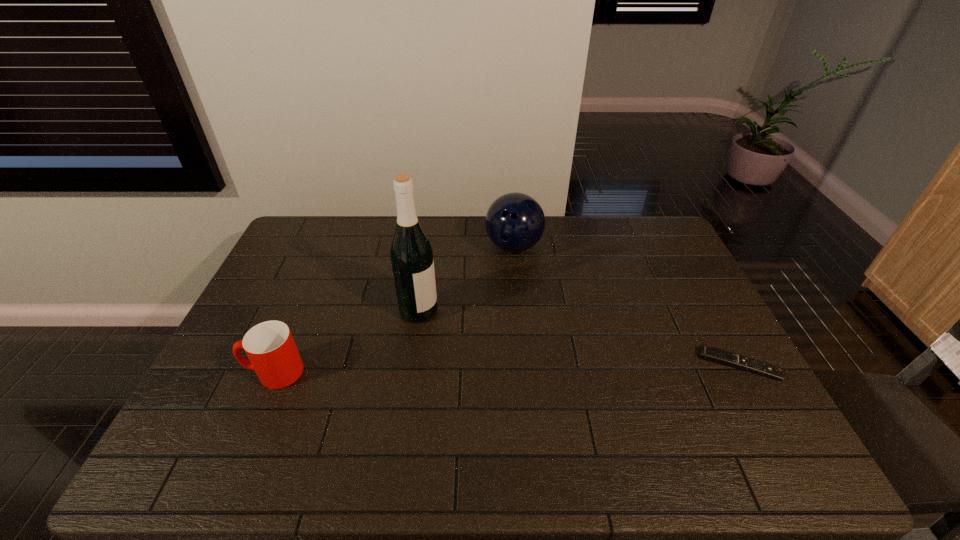
Find the location of a particular element. This screenshot has width=960, height=540. vacant space on the desktop that is between the cup and the shortest object and is positioned on the surface of the bowling ball near the finger holes is located at coordinates click(x=509, y=368).

Locate an element on the screen. This screenshot has height=540, width=960. free spot on the desktop that is between the third tallest object and the rightmost object and is positioned on the label of the tallest object is located at coordinates (554, 368).